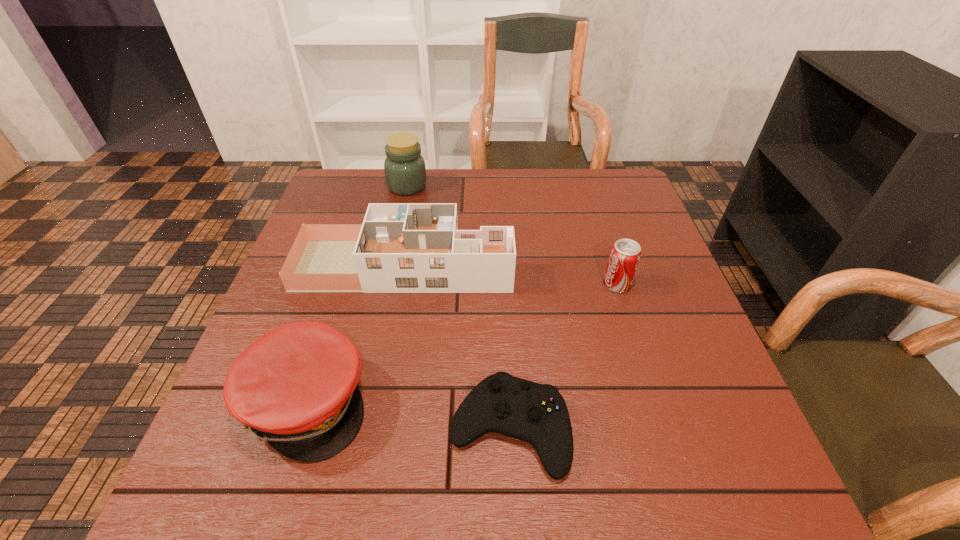
Locate an element on the screen. This screenshot has width=960, height=540. blank space at the left edge of the desktop is located at coordinates (222, 436).

Identify the location of vacant space at the right edge of the desktop. (753, 453).

The height and width of the screenshot is (540, 960). In the image, there is a desktop. What are the coordinates of `free space at the far left corner` in the screenshot? It's located at (364, 197).

The image size is (960, 540). Identify the location of vacant space at the far right corner of the desktop. (612, 184).

This screenshot has height=540, width=960. I want to click on free space between the jar and the control, so click(458, 307).

The image size is (960, 540). What are the coordinates of `vacant space in between the dollhouse and the cap` in the screenshot? It's located at (356, 334).

Where is `empty space that is in between the dollhouse and the cap`? The width and height of the screenshot is (960, 540). empty space that is in between the dollhouse and the cap is located at coordinates (356, 334).

The width and height of the screenshot is (960, 540). I want to click on free point between the shortest object and the cap, so click(408, 415).

Image resolution: width=960 pixels, height=540 pixels. What are the coordinates of `empty location between the cap and the dollhouse` in the screenshot? It's located at (356, 334).

Find the location of `free space between the cap and the shortest object`. free space between the cap and the shortest object is located at coordinates (408, 415).